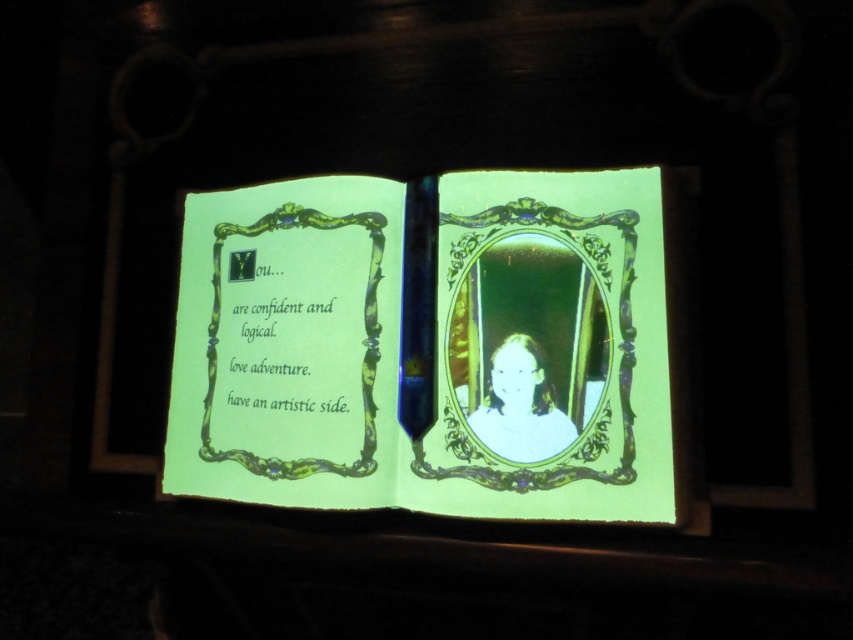
You are holding a green glossy book at center and a green glass mirror at center. Which object is wider?

The green glossy book at center is wider than the green glass mirror at center.

You are holding a flashlight and standing in front of the green glossy book at center and the green glass mirror at center. You want to shine the light on the mirror to see your reflection. Which object should you move your flashlight towards?

The green glossy book at center is to the left of the green glass mirror at center. To shine the light on the mirror, move the flashlight towards the green glass mirror at center.

You are trying to determine which object is bigger between the green glossy book at center and the light beige fabric at center. Based on the scene, which one is larger?

The green glossy book at center is larger in size than the light beige fabric at center according to the description.